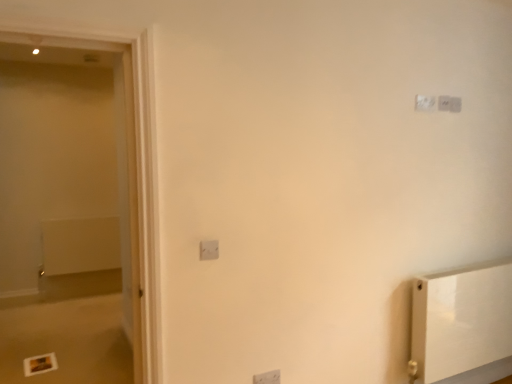
Question: Is white matte radiator at left situated inside white plastic light switch at center, which is counted as the first light switch, starting from the front, or outside?

Choices:
 (A) inside
 (B) outside

Answer: (B)

Question: From a real-world perspective, is white matte radiator at left above or below white plastic light switch at center, the 4th light switch positioned from the right?

Choices:
 (A) below
 (B) above

Answer: (A)

Question: Which is nearer to the white glossy screen door at left?

Choices:
 (A) white plastic light switch at center, the 4th light switch viewed from the back
 (B) white plastic light switch at upper right, the 1th light switch viewed from the right
 (C) white plastic light switch at center, positioned as the second light switch in front-to-back order
 (D) white matte radiator at left
 (E) white plastic light switch at upper right, positioned as the third light switch in bottom-to-top order

Answer: (A)

Question: Estimate the real-world distances between objects in this image. Which object is closer to the white plastic light switch at center, the 4th light switch viewed from the back?

Choices:
 (A) white plastic light switch at center, acting as the 3th light switch starting from the back
 (B) white glossy screen door at left
 (C) white matte radiator at left
 (D) white plastic light switch at upper right, marked as the 4th light switch in a front-to-back arrangement
 (E) white plastic light switch at upper right, positioned as the third light switch in bottom-to-top order

Answer: (B)